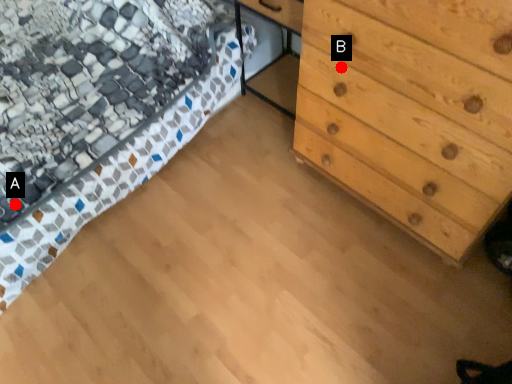
Question: Two points are circled on the image, labeled by A and B beside each circle. Which of the following is the closest to the observer?

Choices:
 (A) A is closer
 (B) B is closer

Answer: (B)